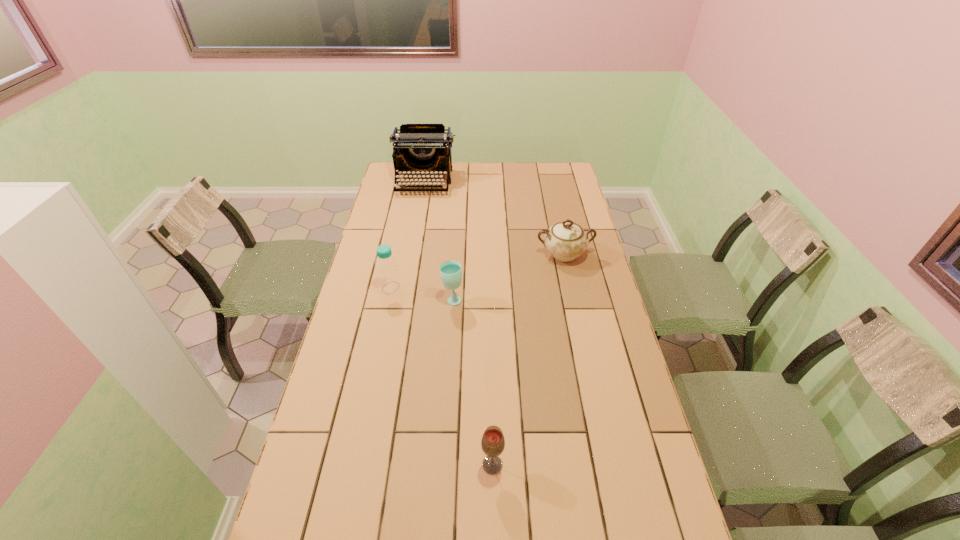
Locate an element on the screen. This screenshot has width=960, height=540. free region at the right edge of the desktop is located at coordinates (583, 263).

Find the location of a particular element. free space at the far right corner of the desktop is located at coordinates (544, 171).

Image resolution: width=960 pixels, height=540 pixels. Identify the location of vacant space that's between the rightmost object and the nearest object. [x=528, y=360].

Where is `free point between the left glass and the right glass`? free point between the left glass and the right glass is located at coordinates (472, 382).

Where is `vacant space that is in between the chinaware and the bottle`? vacant space that is in between the chinaware and the bottle is located at coordinates (477, 271).

This screenshot has height=540, width=960. What are the coordinates of `vacant space that's between the left glass and the nearest object` in the screenshot? It's located at (472, 382).

I want to click on vacant space that's between the farthest object and the bottle, so click(x=408, y=235).

Find the location of a particular element. This screenshot has height=540, width=960. vacant point located between the bottle and the second farthest object is located at coordinates (477, 271).

Locate an element on the screen. the second closest object to the fourth nearest object is located at coordinates (417, 148).

Find the location of a particular element. The height and width of the screenshot is (540, 960). the closest object to the left glass is located at coordinates (388, 275).